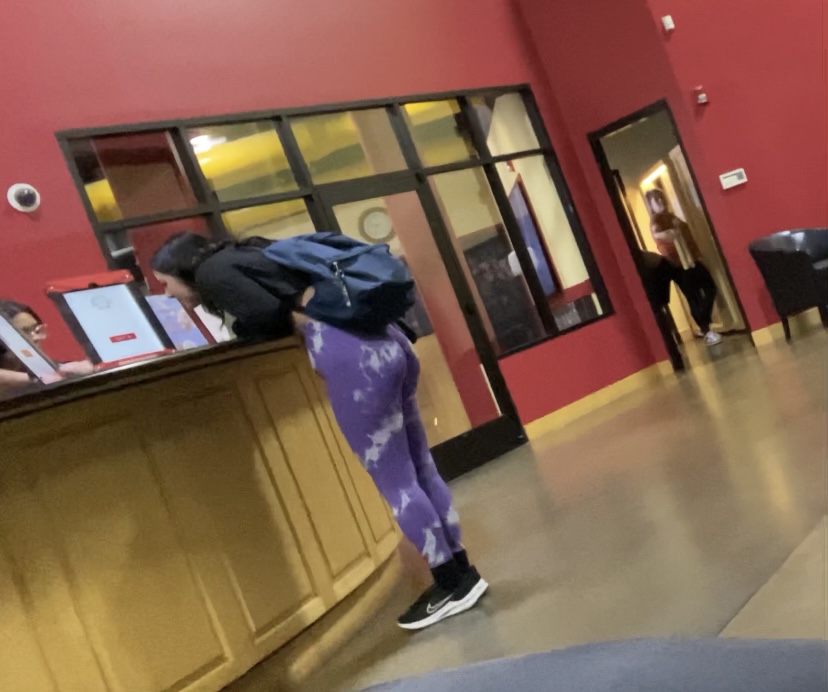
This screenshot has width=828, height=692. I want to click on brown chair, so click(792, 264).